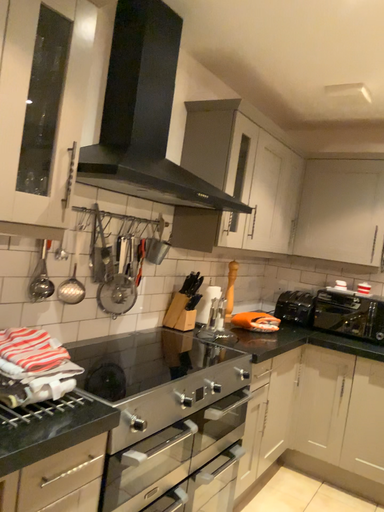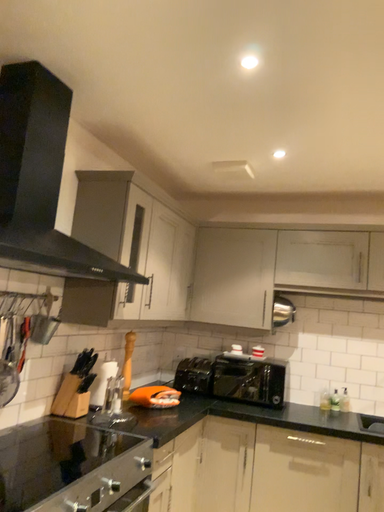
Question: Which way did the camera rotate in the video?

Choices:
 (A) rotated left
 (B) rotated right

Answer: (B)